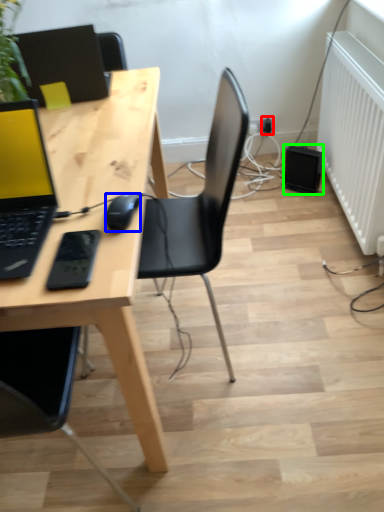
Question: Considering the real-world distances, which object is closest to electric outlet (highlighted by a red box)? mouse (highlighted by a blue box) or speaker (highlighted by a green box).

Choices:
 (A) mouse
 (B) speaker

Answer: (B)